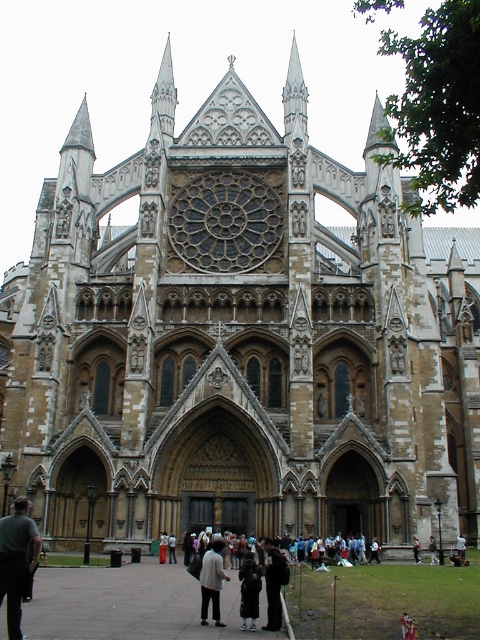
You are a fashion designer observing the Westminster Abbey facade and notice two jackets in the scene. Which jacket has a bigger size between the dark gray fabric jacket at lower left and the light brown leather jacket at center?

The dark gray fabric jacket at lower left is larger in size than the light brown leather jacket at center.

You are standing in front of Westminster Abbey and notice two jackets near the entrance. The dark gray fabric jacket at lower left and the light brown leather jacket at center. Which jacket is closer to you?

The dark gray fabric jacket at lower left is closer to the viewer than the light brown leather jacket at center.